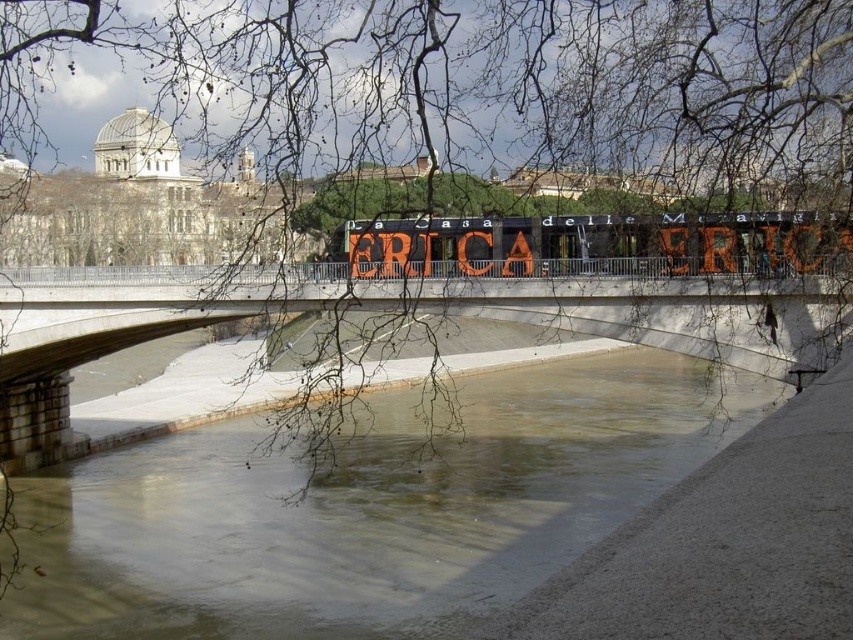
Question: In this image, where is brown concrete river at center located relative to orange painted sign at center?

Choices:
 (A) left
 (B) right

Answer: (B)

Question: Considering the real-world distances, which object is farthest from the brown concrete river at center?

Choices:
 (A) orange painted sign at center
 (B) concrete bridge at center

Answer: (A)

Question: Does brown concrete river at center appear over concrete bridge at center?

Choices:
 (A) yes
 (B) no

Answer: (B)

Question: Which point appears farthest from the camera in this image?

Choices:
 (A) (709, 292)
 (B) (718, 253)

Answer: (B)

Question: Is concrete bridge at center bigger than orange painted sign at center?

Choices:
 (A) yes
 (B) no

Answer: (A)

Question: Which point is farther from the camera taking this photo?

Choices:
 (A) tap(408, 488)
 (B) tap(32, 276)

Answer: (B)